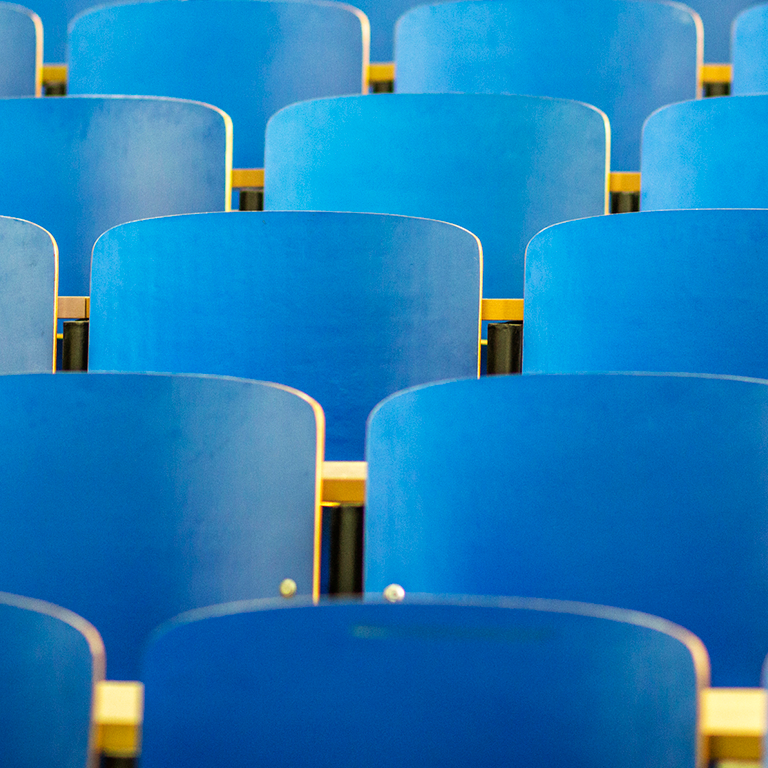
Locate an element on the screen. This screenshot has height=768, width=768. wood blocks behind chairs is located at coordinates (743, 730), (120, 727), (353, 478), (500, 308), (634, 181), (74, 305), (253, 184), (379, 80), (50, 70), (713, 68).